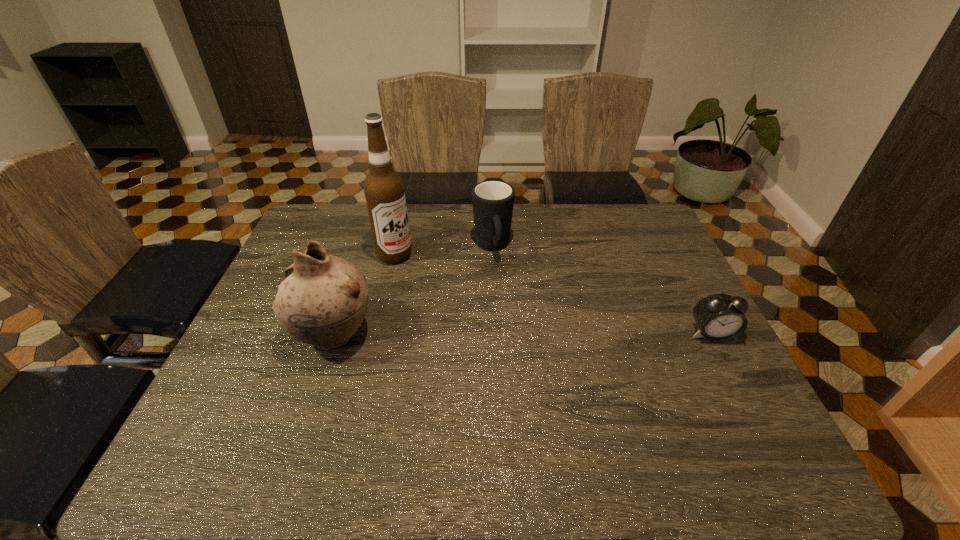
This screenshot has height=540, width=960. In order to click on pottery in this screenshot , I will do `click(322, 300)`.

Where is `the rightmost object`? This screenshot has height=540, width=960. the rightmost object is located at coordinates (720, 317).

In order to click on alarm clock in this screenshot , I will do (720, 317).

At what (x,y) coordinates should I click in order to perform the action: click on alcohol. Please return your answer as a coordinate pair (x, y). The image size is (960, 540). Looking at the image, I should click on (384, 190).

Where is `the second shortest object`? The width and height of the screenshot is (960, 540). the second shortest object is located at coordinates (493, 201).

Locate an element on the screen. The width and height of the screenshot is (960, 540). mug is located at coordinates (493, 201).

The width and height of the screenshot is (960, 540). What are the coordinates of `vacant space located from the spout of the pottery` in the screenshot? It's located at (252, 335).

At what (x,y) coordinates should I click in order to perform the action: click on vacant point located from the spout of the pottery. Please return your answer as a coordinate pair (x, y). The width and height of the screenshot is (960, 540). Looking at the image, I should click on (268, 335).

This screenshot has width=960, height=540. I want to click on vacant space located on the label of the tallest object, so 460,291.

Locate an element on the screen. This screenshot has width=960, height=540. vacant point located 0.060m on the label of the tallest object is located at coordinates (421, 270).